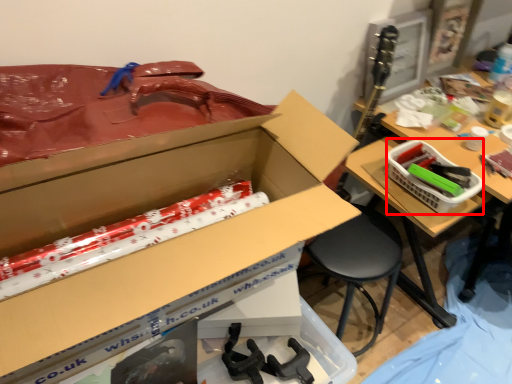
Question: From the image's perspective, where is basket (annotated by the red box) located relative to box?

Choices:
 (A) below
 (B) above

Answer: (B)